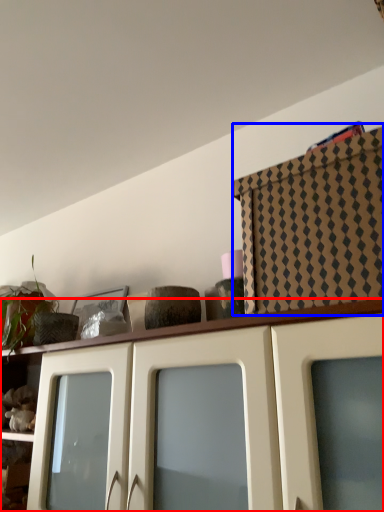
Question: Which object appears farthest to the camera in this image, cabinetry (highlighted by a red box) or cabinetry (highlighted by a blue box)?

Choices:
 (A) cabinetry
 (B) cabinetry

Answer: (B)